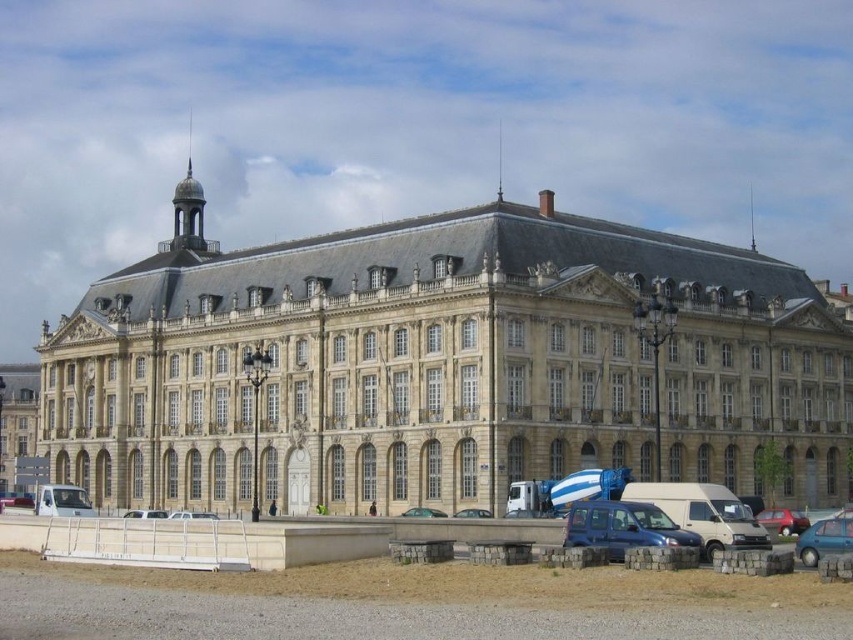
Which of these two, metallic blue van at lower center or metallic blue car at center, stands taller?

metallic blue car at center

I want to click on metallic blue van at lower center, so [x=624, y=528].

Is the position of metallic blue van at lower center more distant than that of white matte van at center?

No.

Who is more forward, (669,522) or (210,515)?

Point (669,522) is in front.

Describe the element at coordinates (624, 528) in the screenshot. I see `metallic blue van at lower center` at that location.

Identify the location of metallic blue van at lower center. This screenshot has width=853, height=640. (624, 528).

Describe the element at coordinates (16, 499) in the screenshot. I see `white matte van at lower left` at that location.

Consider the image. How distant is white matte van at lower left from silver metallic car at center?

They are 42.38 feet apart.

Does point (4, 502) lie in front of point (143, 509)?

No, (4, 502) is behind (143, 509).

Locate an element on the screen. Image resolution: width=853 pixels, height=640 pixels. white matte van at lower left is located at coordinates (16, 499).